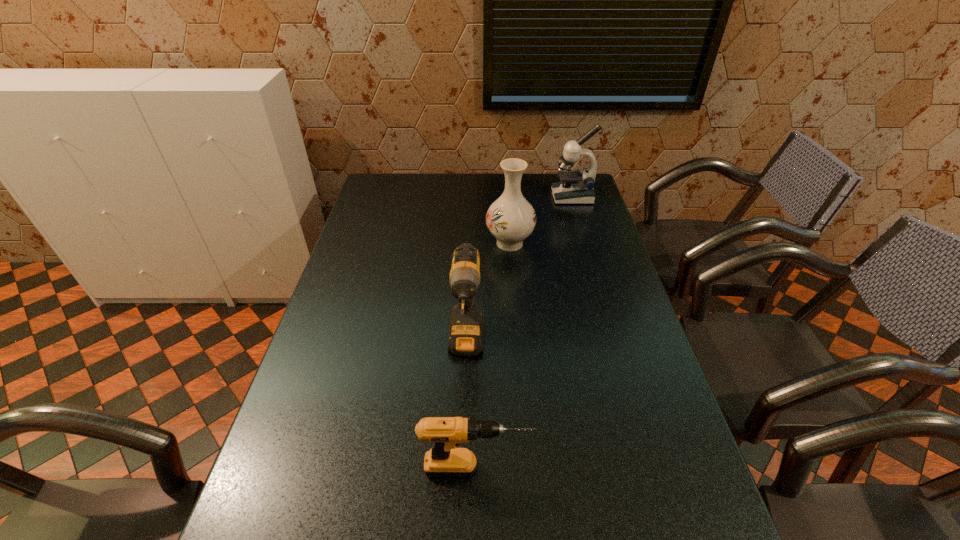
Identify the location of vacant region between the rightmost object and the nearer drill. The height and width of the screenshot is (540, 960). (524, 333).

This screenshot has height=540, width=960. What are the coordinates of `the second closest object relative to the vase` in the screenshot? It's located at (466, 328).

Identify the location of object that is the third closest to the second nearest object. The height and width of the screenshot is (540, 960). (577, 187).

Locate an element on the screen. The height and width of the screenshot is (540, 960). free location that satisfies the following two spatial constraints: 1. at the eyepiece of the microscope; 2. with the drill bit of the second nearest object facing forward is located at coordinates (617, 346).

The height and width of the screenshot is (540, 960). I want to click on vacant area that satisfies the following two spatial constraints: 1. at the eyepiece of the farthest object; 2. with the drill bit of the farther drill facing forward, so click(617, 346).